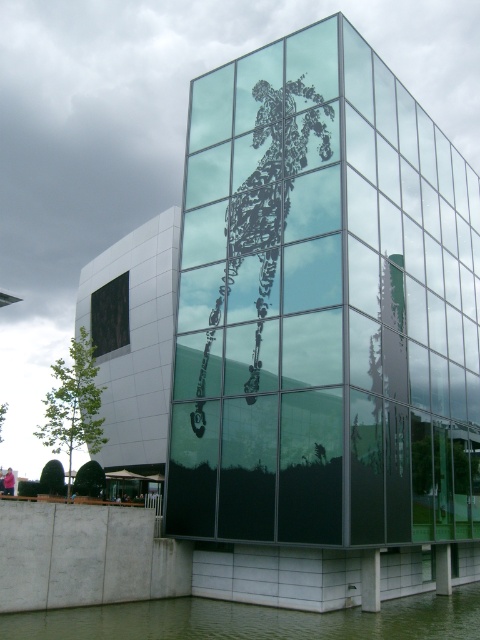
Does green liquid water at lower center appear on the left side of black glass window at lower left?

No, green liquid water at lower center is not to the left of black glass window at lower left.

Who is positioned more to the right, green liquid water at lower center or black glass window at lower left?

Positioned to the right is green liquid water at lower center.

Between point (40, 625) and point (100, 301), which one is positioned in front?

Point (40, 625) is in front.

You are a GUI agent. You are given a task and a screenshot of the screen. Output one action in this format:
    pyautogui.click(x=<x>, y=<y>)
    Task: Click on the green liquid water at lower center
    
    Given the screenshot: What is the action you would take?
    pyautogui.click(x=253, y=620)

Does green liquid water at lower center have a smaller size compared to pink fabric mannequin at lower left?

Yes.

Between point (288, 620) and point (9, 493), which one is positioned behind?

The point (9, 493) is behind.

What are the coordinates of `green liquid water at lower center` in the screenshot? It's located at pyautogui.click(x=253, y=620).

Is black glass window at lower left closer to camera compared to pink fabric mannequin at lower left?

No.

Can you confirm if black glass window at lower left is positioned to the right of pink fabric mannequin at lower left?

Yes, black glass window at lower left is to the right of pink fabric mannequin at lower left.

At what (x,y) coordinates should I click in order to perform the action: click on black glass window at lower left. Please return your answer as a coordinate pair (x, y). The image size is (480, 640). Looking at the image, I should click on tap(109, 316).

You are a GUI agent. You are given a task and a screenshot of the screen. Output one action in this format:
    pyautogui.click(x=<x>, y=<y>)
    Task: Click on the black glass window at lower left
    The height and width of the screenshot is (640, 480).
    Given the screenshot: What is the action you would take?
    pyautogui.click(x=109, y=316)